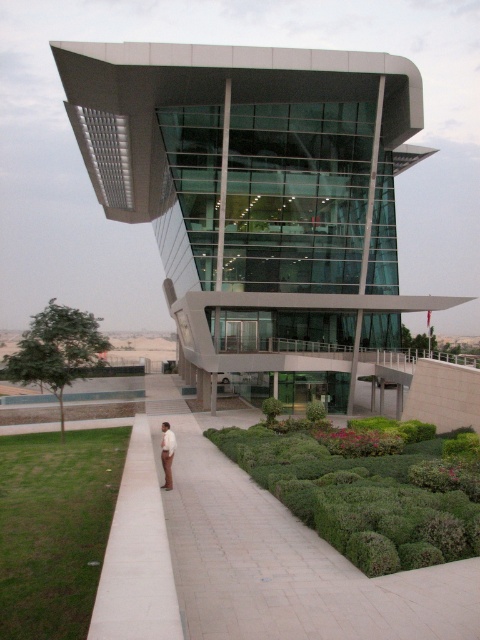
Does glassy modern building at center appear over white smooth shirt at center?

Yes.

Between point (364, 330) and point (171, 438), which one is positioned behind?

Positioned behind is point (364, 330).

Who is more distant from viewer, (x=345, y=109) or (x=166, y=467)?

Positioned behind is point (x=345, y=109).

At what (x,y) coordinates should I click in order to perform the action: click on glassy modern building at center. Please return your answer as a coordinate pair (x, y). Image resolution: width=480 pixels, height=640 pixels. Looking at the image, I should click on (257, 198).

Can you confirm if glassy modern building at center is smaller than green bushy hedge at lower center?

Actually, glassy modern building at center might be larger than green bushy hedge at lower center.

Who is positioned more to the right, glassy modern building at center or green bushy hedge at lower center?

green bushy hedge at lower center

Who is more forward, (115, 193) or (450, 518)?

Positioned in front is point (450, 518).

At what (x,y) coordinates should I click in order to perform the action: click on glassy modern building at center. Please return your answer as a coordinate pair (x, y). Looking at the image, I should click on (257, 198).

Who is shorter, green bushy hedge at lower center or white smooth shirt at center?

With less height is green bushy hedge at lower center.

Describe the element at coordinates (359, 499) in the screenshot. This screenshot has height=640, width=480. I see `green bushy hedge at lower center` at that location.

Is point (247, 464) in front of point (162, 460)?

No, (247, 464) is further to viewer.

Locate an element on the screen. green bushy hedge at lower center is located at coordinates (359, 499).